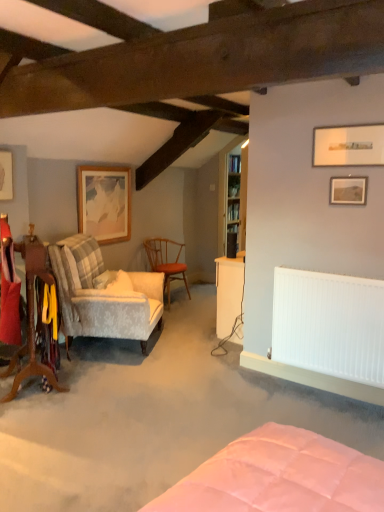
Question: Does matte white picture frame at upper left, which is the 3th picture frame from front to back, appear on the left side of white smooth radiator at right?

Choices:
 (A) yes
 (B) no

Answer: (A)

Question: Considering the relative sizes of matte white picture frame at upper left, marked as the 1th picture frame in a left-to-right arrangement, and white smooth radiator at right in the image provided, is matte white picture frame at upper left, marked as the 1th picture frame in a left-to-right arrangement, bigger than white smooth radiator at right?

Choices:
 (A) no
 (B) yes

Answer: (A)

Question: Would you consider matte white picture frame at upper left, which is the 3th picture frame from front to back, to be distant from white smooth radiator at right?

Choices:
 (A) no
 (B) yes

Answer: (B)

Question: Is matte white picture frame at upper left, marked as the 1th picture frame in a left-to-right arrangement, next to white smooth radiator at right?

Choices:
 (A) yes
 (B) no

Answer: (B)

Question: Is matte white picture frame at upper left, which is the 3th picture frame from front to back, oriented towards white smooth radiator at right?

Choices:
 (A) no
 (B) yes

Answer: (A)

Question: Considering the relative sizes of matte white picture frame at upper left, marked as the 2th picture frame in a back-to-front arrangement, and white smooth radiator at right in the image provided, is matte white picture frame at upper left, marked as the 2th picture frame in a back-to-front arrangement, smaller than white smooth radiator at right?

Choices:
 (A) yes
 (B) no

Answer: (A)

Question: Is wooden bookshelf at upper center touching velvet-patterned armchair at left, the second chair when ordered from front to back?

Choices:
 (A) no
 (B) yes

Answer: (A)

Question: Would you say wooden bookshelf at upper center contains velvet-patterned armchair at left, which is the second chair from back to front?

Choices:
 (A) no
 (B) yes

Answer: (A)

Question: From the image's perspective, is wooden bookshelf at upper center below velvet-patterned armchair at left, which is the second chair from back to front?

Choices:
 (A) no
 (B) yes

Answer: (A)

Question: From a real-world perspective, is wooden bookshelf at upper center located higher than velvet-patterned armchair at left, the second chair when ordered from front to back?

Choices:
 (A) no
 (B) yes

Answer: (B)

Question: Does wooden bookshelf at upper center have a larger size compared to velvet-patterned armchair at left, the second chair when ordered from front to back?

Choices:
 (A) no
 (B) yes

Answer: (A)

Question: Does wooden bookshelf at upper center come in front of velvet-patterned armchair at left, which is the second chair from back to front?

Choices:
 (A) no
 (B) yes

Answer: (A)

Question: Is matte white picture frame at upper right, the third picture frame in the left-to-right sequence, thinner than white soft pillow at left?

Choices:
 (A) yes
 (B) no

Answer: (A)